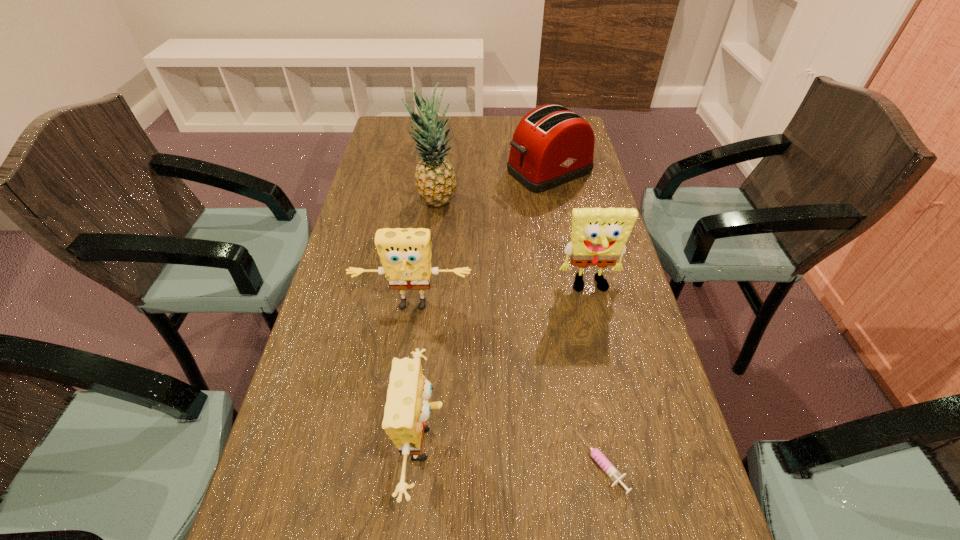
Find the location of `object that is at the left edge`. object that is at the left edge is located at coordinates (405, 254).

Locate an element on the screen. The width and height of the screenshot is (960, 540). sponge located in the right edge section of the desktop is located at coordinates (599, 235).

Identify the location of toaster located in the right edge section of the desktop. (551, 145).

At what (x,y) coordinates should I click in order to perform the action: click on syringe that is positioned at the right edge. Please return your answer as a coordinate pair (x, y). Looking at the image, I should click on (611, 471).

Locate an element on the screen. free space at the far edge is located at coordinates (512, 129).

The image size is (960, 540). In the image, there is a desktop. Identify the location of blank space at the left edge. (308, 439).

In the image, there is a desktop. Where is `free region at the right edge`? Image resolution: width=960 pixels, height=540 pixels. free region at the right edge is located at coordinates (648, 396).

The image size is (960, 540). I want to click on free space at the far left corner of the desktop, so click(x=381, y=143).

The image size is (960, 540). I want to click on vacant space in between the toaster and the nearest sponge, so click(x=487, y=307).

Where is `free spot between the nearest sponge and the shortest object`? free spot between the nearest sponge and the shortest object is located at coordinates (513, 453).